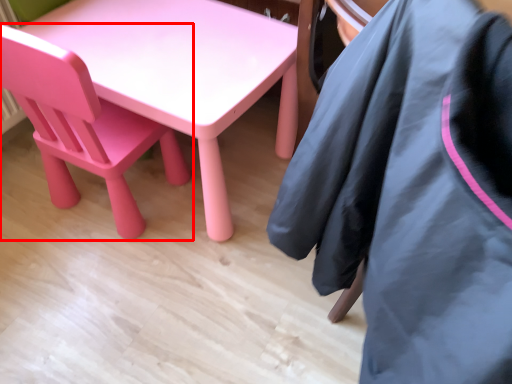
Question: From the image's perspective, where is chair (annotated by the red box) located relative to jacket?

Choices:
 (A) above
 (B) below

Answer: (A)